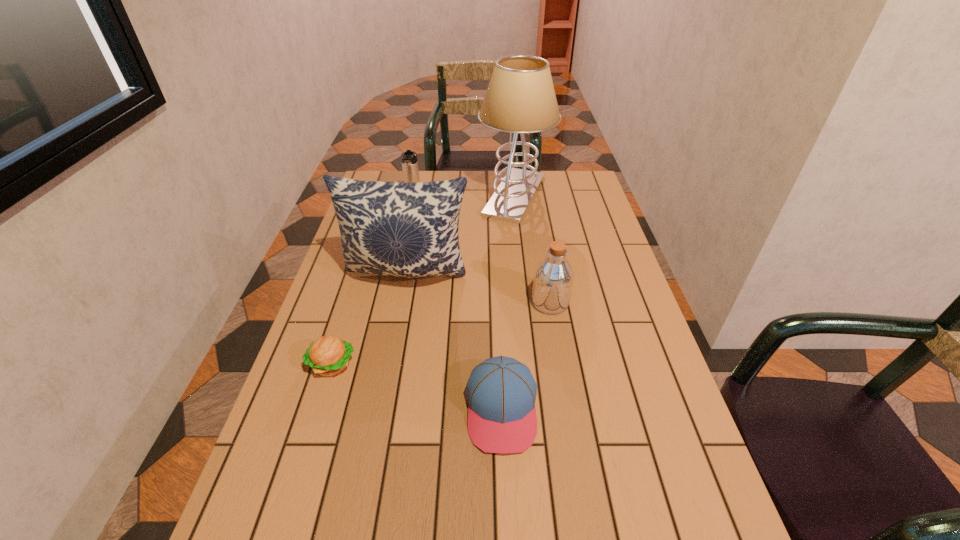
Image resolution: width=960 pixels, height=540 pixels. What are the coordinates of `table lamp` in the screenshot? It's located at (520, 98).

Locate an element on the screen. The height and width of the screenshot is (540, 960). the second tallest object is located at coordinates (403, 229).

You are a GUI agent. You are given a task and a screenshot of the screen. Output one action in this format:
    pyautogui.click(x=<x>, y=<y>)
    Task: Click on the thermos bottle
    The height and width of the screenshot is (540, 960).
    Given the screenshot: What is the action you would take?
    pyautogui.click(x=410, y=169)

The image size is (960, 540). I want to click on bottle, so click(553, 279).

I want to click on baseball cap, so click(x=501, y=391).

Where is `hamburger`? The height and width of the screenshot is (540, 960). hamburger is located at coordinates (328, 355).

Locate an element on the screen. Image resolution: width=960 pixels, height=540 pixels. vacant region located 0.300m on the front of the table lamp is located at coordinates coord(524,280).

The width and height of the screenshot is (960, 540). I want to click on vacant space situated on the front surface of the fifth shortest object, so click(386, 388).

Where is `free point located 0.380m on the handle side of the thermos bottle`? free point located 0.380m on the handle side of the thermos bottle is located at coordinates (398, 277).

Locate an element on the screen. free space located 0.180m on the left of the bottle is located at coordinates (468, 303).